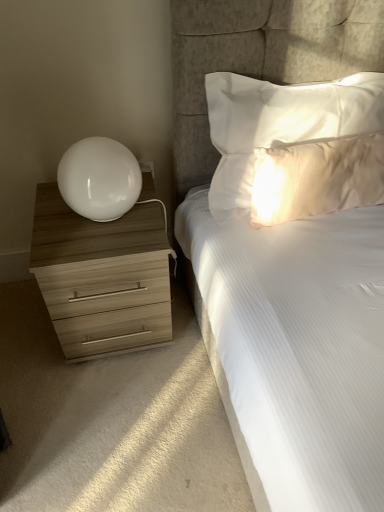
Question: Is white glossy table lamp at left at the right side of wooden chest of drawers at left?

Choices:
 (A) no
 (B) yes

Answer: (B)

Question: Can you confirm if white glossy table lamp at left is thinner than wooden chest of drawers at left?

Choices:
 (A) yes
 (B) no

Answer: (A)

Question: Considering the relative sizes of white glossy table lamp at left and wooden chest of drawers at left in the image provided, is white glossy table lamp at left taller than wooden chest of drawers at left?

Choices:
 (A) yes
 (B) no

Answer: (B)

Question: From a real-world perspective, is white glossy table lamp at left beneath wooden chest of drawers at left?

Choices:
 (A) no
 (B) yes

Answer: (A)

Question: Is white glossy table lamp at left shorter than wooden chest of drawers at left?

Choices:
 (A) yes
 (B) no

Answer: (A)

Question: In terms of height, does white glossy table lamp at left look taller or shorter compared to wooden chest of drawers at left?

Choices:
 (A) tall
 (B) short

Answer: (B)

Question: Looking at their shapes, would you say white glossy table lamp at left is wider or thinner than wooden chest of drawers at left?

Choices:
 (A) thin
 (B) wide

Answer: (A)

Question: Considering their positions, is white glossy table lamp at left located in front of or behind wooden chest of drawers at left?

Choices:
 (A) behind
 (B) front

Answer: (B)

Question: Does point (86, 195) appear closer or farther from the camera than point (71, 349)?

Choices:
 (A) farther
 (B) closer

Answer: (B)

Question: From the image's perspective, is satin white pillow at upper right, which ranks as the 2th pillow in top-to-bottom order, positioned above or below wooden chest of drawers at left?

Choices:
 (A) below
 (B) above

Answer: (B)

Question: Considering the relative positions of satin white pillow at upper right, which ranks as the 2th pillow in top-to-bottom order, and wooden chest of drawers at left in the image provided, is satin white pillow at upper right, which ranks as the 2th pillow in top-to-bottom order, to the left or to the right of wooden chest of drawers at left?

Choices:
 (A) left
 (B) right

Answer: (B)

Question: From a real-world perspective, is satin white pillow at upper right, which ranks as the first pillow in bottom-to-top order, physically located above or below wooden chest of drawers at left?

Choices:
 (A) below
 (B) above

Answer: (B)

Question: Looking at the image, does satin white pillow at upper right, which ranks as the 2th pillow in top-to-bottom order, seem bigger or smaller compared to wooden chest of drawers at left?

Choices:
 (A) small
 (B) big

Answer: (A)

Question: From their relative heights in the image, would you say wooden chest of drawers at left is taller or shorter than white satin pillow at upper right, the second pillow ordered from the bottom?

Choices:
 (A) tall
 (B) short

Answer: (A)

Question: Relative to white satin pillow at upper right, the first pillow in the top-to-bottom sequence, is wooden chest of drawers at left in front or behind?

Choices:
 (A) behind
 (B) front

Answer: (A)